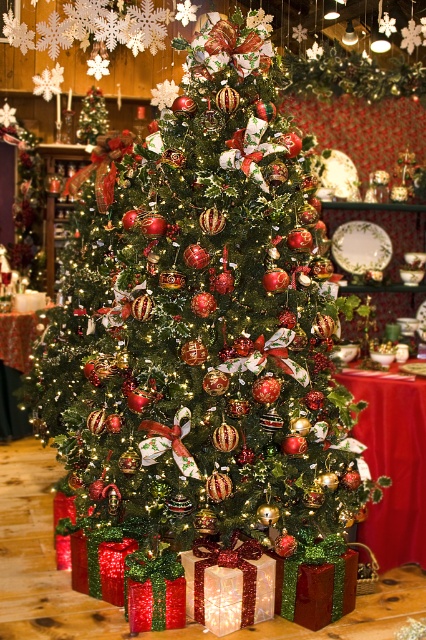
You are a visitor at a Christmas market and want to take a photo of the shiny metallic ornaments at center and the red cloth table at center. Which object should you focus on first if you want to capture both in a single frame without moving the camera?

The shiny metallic ornaments at center is taller than the red cloth table at center, so you should focus on the shiny metallic ornaments at center first to ensure both are in frame.

You are a customer in a store and see the shiny metallic ornaments at center and the red cloth table at center. Which object is located above the other?

The shiny metallic ornaments at center is positioned over the red cloth table at center.

You are a customer standing in front of the Christmas tree and want to pick up the shiny metallic ornaments at center and the red cloth table at center. Which object can you reach first without moving your position?

The shiny metallic ornaments at center is closer to the viewer than the red cloth table at center, so you can reach the shiny metallic ornaments at center first without moving your position.